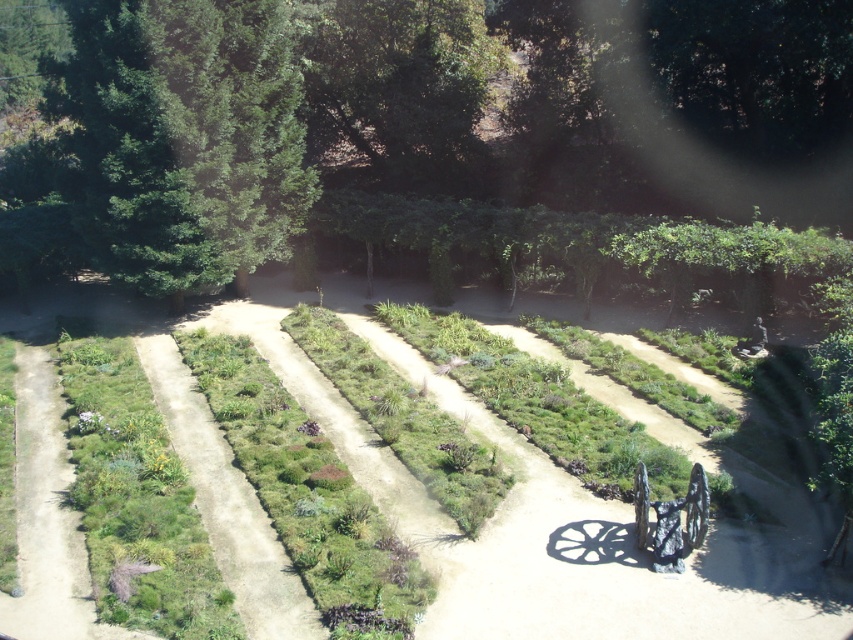
Looking at this image, you are a gardener who needs to install a 2.5 meter long fence between the green leafy tree at upper center and the green leafy tree at upper left. Based on the garden layout, will the fence fit between them without overlapping the trees?

The distance between the green leafy tree at upper center and the green leafy tree at upper left is 1.92 meters. Since the fence is 2.5 meters long, it will not fit between them without overlapping the trees because the distance is shorter than the fence length.

You are a gardener who needs to move a heavy bag of soil from the entrance to the shiny metallic wagon at center. The green leafy tree at upper center is in your path. Considering their sizes, can you walk around the tree without disturbing it?

The green leafy tree at upper center is larger than the shiny metallic wagon at center. Since the tree is bigger, there might be enough space to walk around it, but you need to be cautious to avoid damaging the tree or nearby plants.